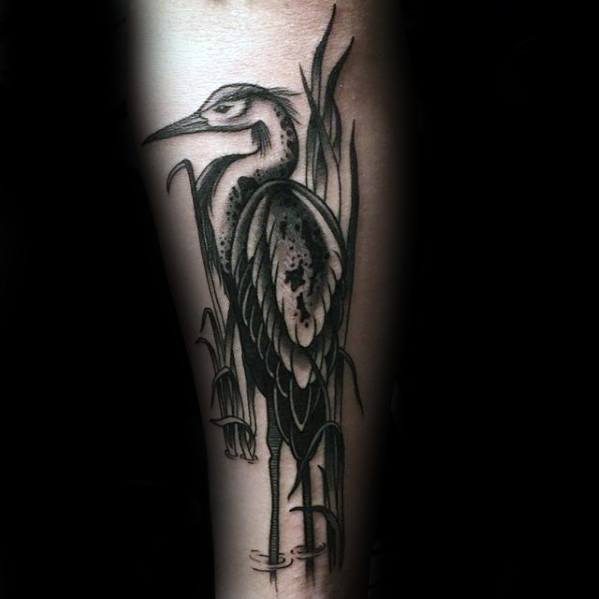
The image size is (599, 599). I want to click on water rings, so click(285, 567), click(300, 553).